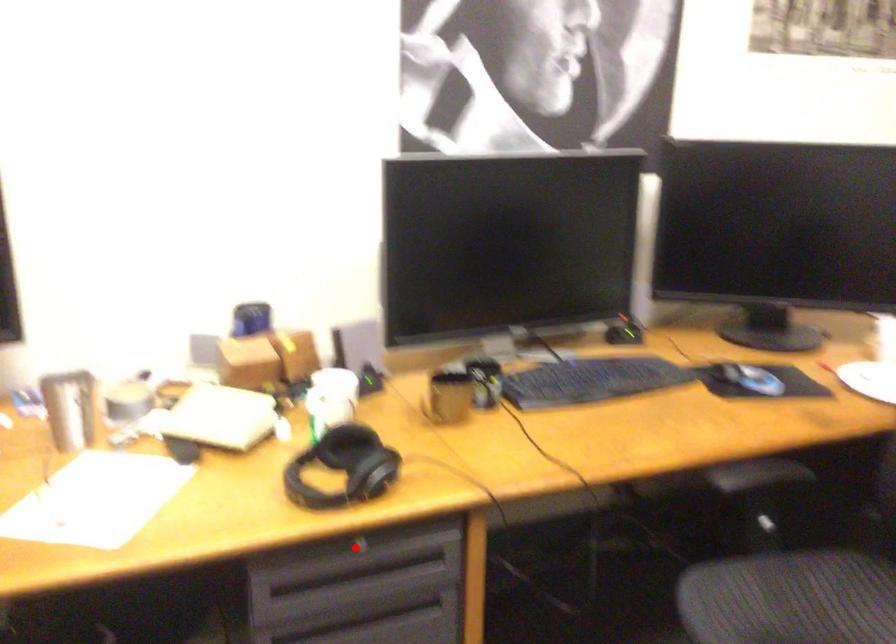
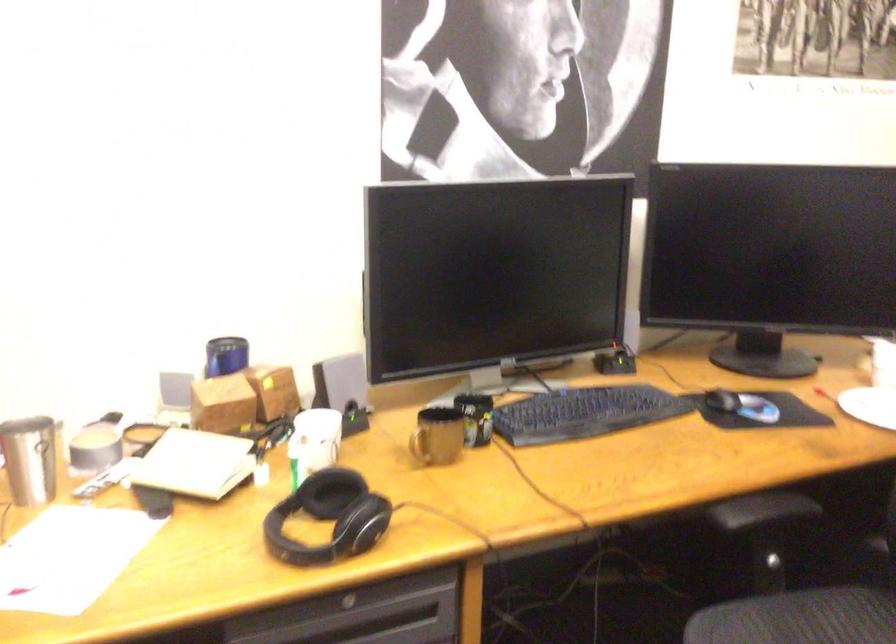
Locate, in the second image, the point that corresponds to the highlighted location in the first image.

(347, 603)